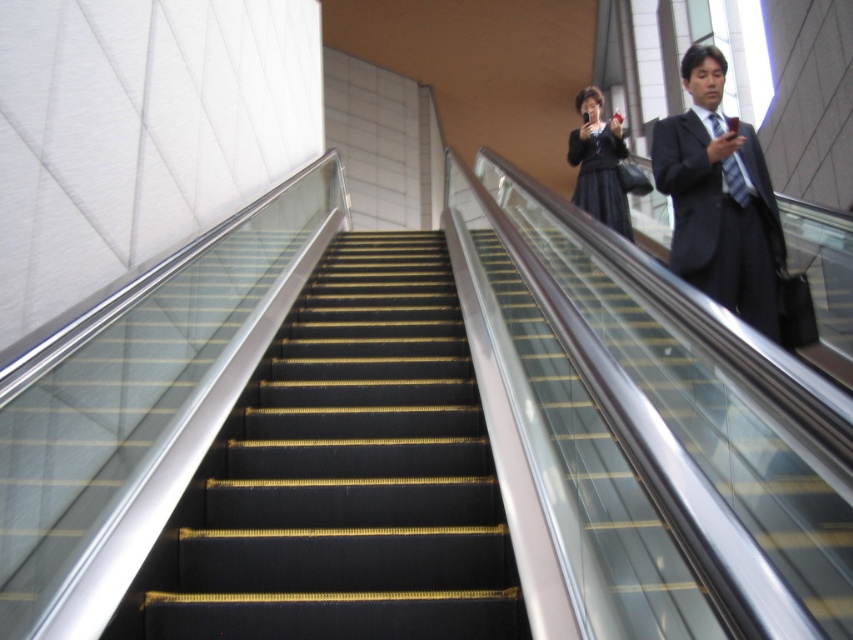
You are standing at the bottom of the escalator and want to reach the top. The black rubber stairs at center are part of the escalator. What is the vertical distance from the bottom to the top of the escalator if each step is 18 cm tall and there are 20 steps?

The vertical distance from the bottom to the top of the escalator is 360 cm because each step is 18 cm tall and there are 20 steps, so 18 multiplied by 20 equals 360 cm.

You are standing at the bottom of the escalator and want to reach the dark gray suit at upper right. How many steps do you need to climb on the black rubber stairs at center to get there?

The black rubber stairs at center is 5.09 feet away from dark gray suit at upper right. Assuming each step is about 0.165 feet high, you would need to climb approximately 30.85 steps. Since you can only climb whole steps, you would need to climb 31 steps to reach the dark gray suit at upper right.